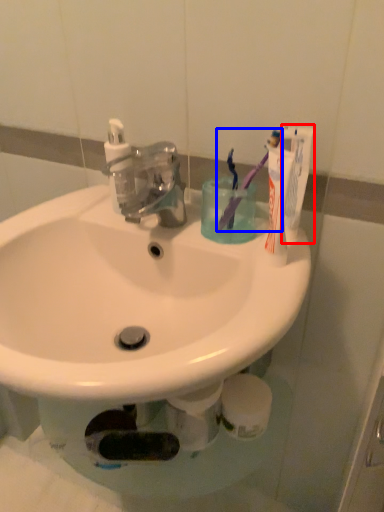
Question: Which of the following is the closest to the observer, toothpaste (highlighted by a red box) or toothbrush (highlighted by a blue box)?

Choices:
 (A) toothpaste
 (B) toothbrush

Answer: (A)